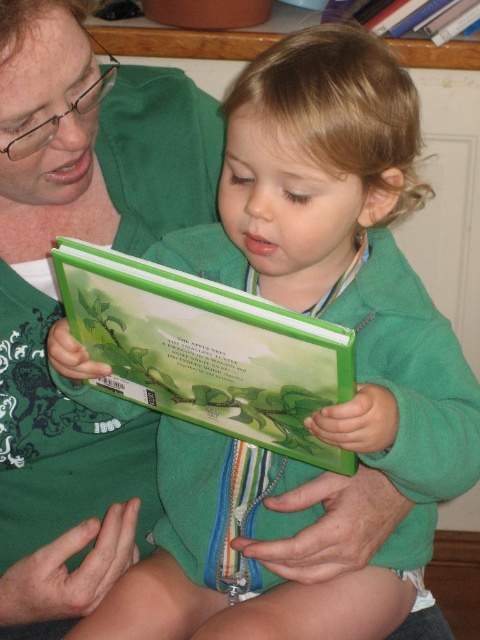
Question: Can you confirm if green matte book at upper left is positioned to the right of green matte book at upper center?

Choices:
 (A) no
 (B) yes

Answer: (A)

Question: Which point is closer to the camera?

Choices:
 (A) green matte book at center
 (B) green matte book at upper center
 (C) green matte book at upper left

Answer: (C)

Question: Which of the following is the farthest from the observer?

Choices:
 (A) (250, 424)
 (B) (143, 506)
 (C) (362, 4)

Answer: (C)

Question: Can you confirm if green matte book at upper left is thinner than green matte book at upper center?

Choices:
 (A) no
 (B) yes

Answer: (A)

Question: Where is green matte book at center located in relation to green matte book at upper center in the image?

Choices:
 (A) above
 (B) below

Answer: (B)

Question: Estimate the real-world distances between objects in this image. Which object is closer to the green matte book at center?

Choices:
 (A) green matte book at upper center
 (B) green matte book at upper left

Answer: (B)